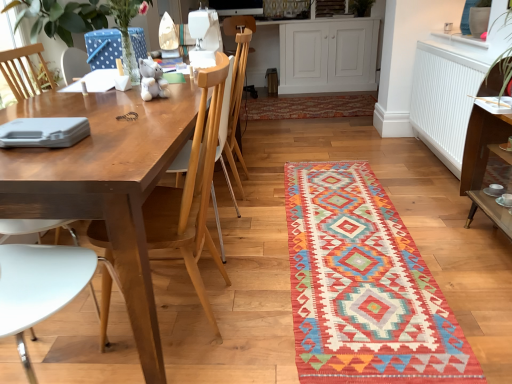
Question: Can you confirm if white wood cabinet at upper center is taller than white matte radiator at upper right?

Choices:
 (A) yes
 (B) no

Answer: (A)

Question: From a real-world perspective, does white wood cabinet at upper center sit lower than white matte radiator at upper right?

Choices:
 (A) no
 (B) yes

Answer: (A)

Question: Does white wood cabinet at upper center appear on the left side of white matte radiator at upper right?

Choices:
 (A) no
 (B) yes

Answer: (B)

Question: Is white wood cabinet at upper center smaller than white matte radiator at upper right?

Choices:
 (A) no
 (B) yes

Answer: (A)

Question: From the image's perspective, is white wood cabinet at upper center on top of white matte radiator at upper right?

Choices:
 (A) no
 (B) yes

Answer: (B)

Question: Is white wood cabinet at upper center at the right side of white matte radiator at upper right?

Choices:
 (A) no
 (B) yes

Answer: (A)

Question: Considering the relative sizes of wooden chair at left and multicolored woven mat at center in the image provided, is wooden chair at left smaller than multicolored woven mat at center?

Choices:
 (A) yes
 (B) no

Answer: (B)

Question: Considering the relative sizes of wooden chair at left and multicolored woven mat at center in the image provided, is wooden chair at left wider than multicolored woven mat at center?

Choices:
 (A) yes
 (B) no

Answer: (B)

Question: Is wooden chair at left closer to the viewer compared to multicolored woven mat at center?

Choices:
 (A) yes
 (B) no

Answer: (A)

Question: From a real-world perspective, is wooden chair at left over multicolored woven mat at center?

Choices:
 (A) no
 (B) yes

Answer: (B)

Question: Is wooden chair at left surrounding multicolored woven mat at center?

Choices:
 (A) yes
 (B) no

Answer: (B)

Question: Is wooden chair at left taller than multicolored woven mat at center?

Choices:
 (A) no
 (B) yes

Answer: (B)

Question: Is multicolored woven mat at center located within wooden chair at center?

Choices:
 (A) no
 (B) yes

Answer: (A)